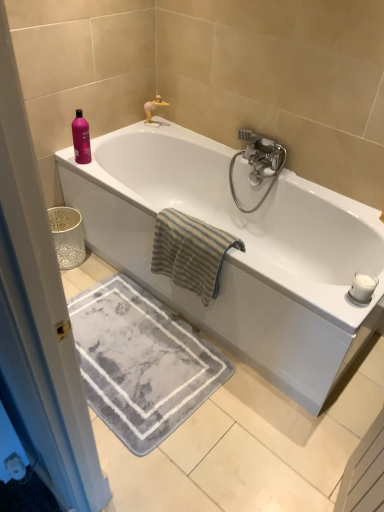
The image size is (384, 512). What do you see at coordinates (153, 110) in the screenshot?
I see `silver metallic faucet at upper center` at bounding box center [153, 110].

Image resolution: width=384 pixels, height=512 pixels. Describe the element at coordinates (190, 252) in the screenshot. I see `beige striped towel at center` at that location.

What do you see at coordinates (81, 139) in the screenshot? I see `pink glossy bottle at upper left` at bounding box center [81, 139].

Where is `silver metallic faucet at upper center`? silver metallic faucet at upper center is located at coordinates (153, 110).

Is point (73, 124) farther from viewer compared to point (204, 204)?

No, it is in front of (204, 204).

Is white glossy bathtub at upper center at the back of pink glossy bottle at upper left?

pink glossy bottle at upper left does not have its back to white glossy bathtub at upper center.

Is pink glossy bottle at upper left smaller than white glossy bathtub at upper center?

Indeed, pink glossy bottle at upper left has a smaller size compared to white glossy bathtub at upper center.

Locate an element on the screen. Image resolution: width=384 pixels, height=512 pixels. toiletry on the left side of white glossy bathtub at upper center is located at coordinates (81, 139).

Would you say beige striped towel at center is to the left or to the right of white glossy bathtub at upper center in the picture?

In the image, beige striped towel at center appears on the left side of white glossy bathtub at upper center.

Is beige striped towel at center taller or shorter than white glossy bathtub at upper center?

beige striped towel at center is shorter than white glossy bathtub at upper center.

Does beige striped towel at center have a smaller size compared to white glossy bathtub at upper center?

Yes.

Based on the photo, how much distance is there between beige striped towel at center and white glossy bathtub at upper center?

12.52 inches.

Does beige striped towel at center appear on the left side of pink glossy bottle at upper left?

Incorrect, beige striped towel at center is not on the left side of pink glossy bottle at upper left.

Could you tell me if beige striped towel at center is facing pink glossy bottle at upper left?

No, beige striped towel at center is not facing towards pink glossy bottle at upper left.

Is beige striped towel at center far away from pink glossy bottle at upper left?

That's not correct — beige striped towel at center is a little close to pink glossy bottle at upper left.

Which is less distant, (x=203, y=258) or (x=79, y=143)?

Point (x=203, y=258) is closer to the camera than point (x=79, y=143).

Is point (177, 408) farther from camera compared to point (207, 251)?

Yes, it is.

Considering the sizes of objects gray soft rug at lower center and beige striped towel at center in the image provided, who is smaller, gray soft rug at lower center or beige striped towel at center?

gray soft rug at lower center.

From the image's perspective, is gray soft rug at lower center below beige striped towel at center?

Indeed, from the image's perspective, gray soft rug at lower center is shown beneath beige striped towel at center.

Would you say pink glossy bottle at upper left is outside gray soft rug at lower center?

Yes, pink glossy bottle at upper left is located beyond the bounds of gray soft rug at lower center.

You are a GUI agent. You are given a task and a screenshot of the screen. Output one action in this format:
    pyautogui.click(x=<x>, y=<y>)
    Task: Click on the bath mat below the pink glossy bottle at upper left (from a real-world perspective)
    The width and height of the screenshot is (384, 512).
    Given the screenshot: What is the action you would take?
    (141, 362)

Considering the points (81, 152) and (141, 407), which point is in front, point (81, 152) or point (141, 407)?

Point (141, 407)

Is pink glossy bottle at upper left thinner than gray soft rug at lower center?

Correct, the width of pink glossy bottle at upper left is less than that of gray soft rug at lower center.

From the picture: Considering the positions of objects silver metallic faucet at upper center and satin nickel faucet at upper right in the image provided, who is more to the left, silver metallic faucet at upper center or satin nickel faucet at upper right?

silver metallic faucet at upper center is more to the left.

Image resolution: width=384 pixels, height=512 pixels. What are the coordinates of `faucet that appears above the satin nickel faucet at upper right (from the image's perspective)` in the screenshot? It's located at coord(153,110).

Based on the photo, is silver metallic faucet at upper center directly adjacent to satin nickel faucet at upper right?

No, silver metallic faucet at upper center is not beside satin nickel faucet at upper right.

Is point (146, 117) positioned after point (271, 169)?

Yes, point (146, 117) is farther from viewer.

Considering the sizes of objects silver metallic faucet at upper center and gray soft rug at lower center in the image provided, who is taller, silver metallic faucet at upper center or gray soft rug at lower center?

Standing taller between the two is silver metallic faucet at upper center.

Is silver metallic faucet at upper center positioned in front of gray soft rug at lower center?

No.

From the image's perspective, between silver metallic faucet at upper center and gray soft rug at lower center, which one is located above?

silver metallic faucet at upper center, from the image's perspective.

Where is `toiletry lying on the left of white glossy bathtub at upper center`? This screenshot has width=384, height=512. toiletry lying on the left of white glossy bathtub at upper center is located at coordinates (81, 139).

Find the location of a particular element. This screenshot has width=384, height=512. bathtub that appears above the beige striped towel at center (from the image's perspective) is located at coordinates (239, 251).

Based on their spatial positions, is beige striped towel at center or satin nickel faucet at upper right further from silver metallic faucet at upper center?

Based on the image, beige striped towel at center appears to be further to silver metallic faucet at upper center.

Based on their spatial positions, is satin nickel faucet at upper right or pink glossy bottle at upper left closer to beige striped towel at center?

Among the two, satin nickel faucet at upper right is located nearer to beige striped towel at center.

Based on their spatial positions, is white glossy bathtub at upper center or beige striped towel at center further from satin nickel faucet at upper right?

Among the two, beige striped towel at center is located further to satin nickel faucet at upper right.

In the scene shown: Considering their positions, is silver metallic faucet at upper center positioned further to satin nickel faucet at upper right than white glossy bathtub at upper center?

The object further to satin nickel faucet at upper right is silver metallic faucet at upper center.

Which object lies nearer to the anchor point pink glossy bottle at upper left, satin nickel faucet at upper right or white glossy bathtub at upper center?

white glossy bathtub at upper center is positioned closer to the anchor pink glossy bottle at upper left.

Which object lies further to the anchor point satin nickel faucet at upper right, white glossy bathtub at upper center or gray soft rug at lower center?

gray soft rug at lower center is further to satin nickel faucet at upper right.

Estimate the real-world distances between objects in this image. Which object is closer to white glossy bathtub at upper center, satin nickel faucet at upper right or pink glossy bottle at upper left?

satin nickel faucet at upper right lies closer to white glossy bathtub at upper center than the other object.

Which object lies further to the anchor point silver metallic faucet at upper center, gray soft rug at lower center or beige striped towel at center?

Based on the image, gray soft rug at lower center appears to be further to silver metallic faucet at upper center.

Image resolution: width=384 pixels, height=512 pixels. Identify the location of tap between pink glossy bottle at upper left and gray soft rug at lower center in the vertical direction. (258, 162).

Where is `tap between silver metallic faucet at upper center and beige striped towel at center in the vertical direction`? tap between silver metallic faucet at upper center and beige striped towel at center in the vertical direction is located at coordinates (258, 162).

Where is `bathtub that lies between silver metallic faucet at upper center and gray soft rug at lower center from top to bottom`? The width and height of the screenshot is (384, 512). bathtub that lies between silver metallic faucet at upper center and gray soft rug at lower center from top to bottom is located at coordinates (239, 251).

Where is `tap that lies between silver metallic faucet at upper center and gray soft rug at lower center from top to bottom`? tap that lies between silver metallic faucet at upper center and gray soft rug at lower center from top to bottom is located at coordinates (258, 162).